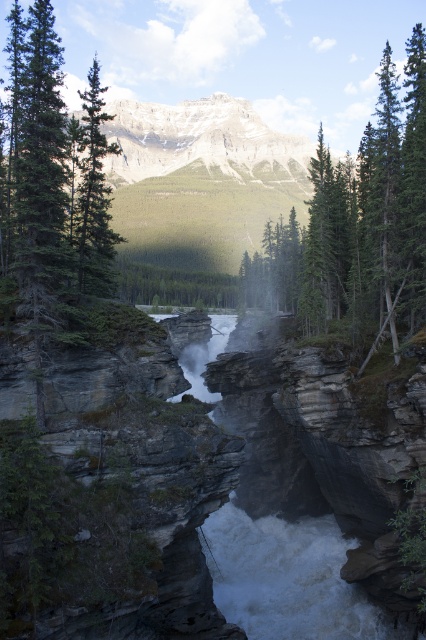
In the scene shown: Can you confirm if green matte tree at center is positioned below green matte tree at left?

Correct, green matte tree at center is located below green matte tree at left.

Between point (416, 256) and point (83, 147), which one is positioned in front?

Point (83, 147)

You are a GUI agent. You are given a task and a screenshot of the screen. Output one action in this format:
    pyautogui.click(x=<x>, y=<y>)
    Task: Click on the green matte tree at center
    
    Given the screenshot: What is the action you would take?
    pyautogui.click(x=357, y=227)